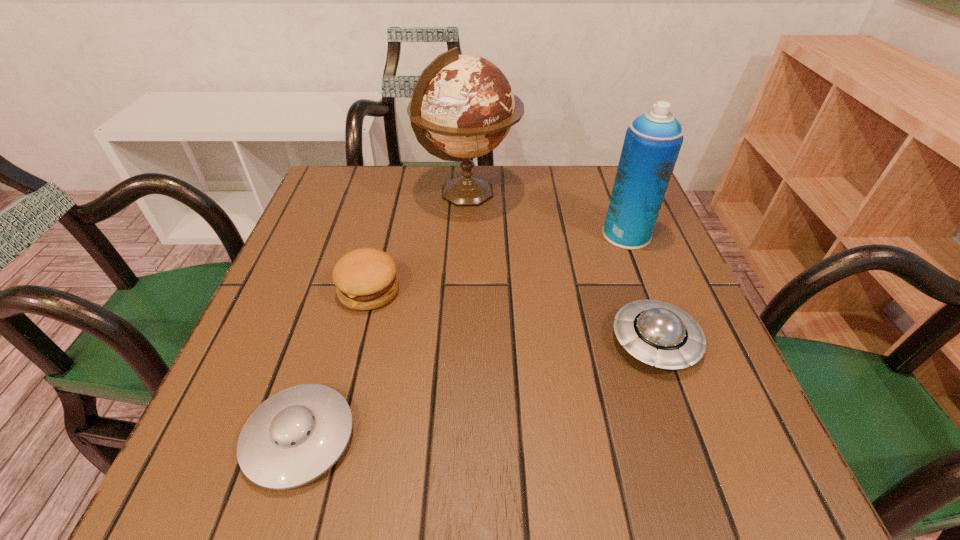
Identify the location of free location located on the left of the right saucer. Image resolution: width=960 pixels, height=540 pixels. (441, 341).

Image resolution: width=960 pixels, height=540 pixels. Identify the location of vacant area situated on the back of the shortest object. (360, 240).

At what (x,y) coordinates should I click in order to perform the action: click on object that is at the far edge. Please return your answer as a coordinate pair (x, y). Looking at the image, I should click on (464, 104).

What are the coordinates of `object situated at the near edge` in the screenshot? It's located at (296, 435).

The height and width of the screenshot is (540, 960). I want to click on hamburger that is at the left edge, so click(x=365, y=279).

This screenshot has height=540, width=960. I want to click on saucer positioned at the left edge, so click(296, 435).

Where is `aerosol can positioned at the right edge`? aerosol can positioned at the right edge is located at coordinates (652, 143).

Identify the location of saucer situated at the right edge. This screenshot has height=540, width=960. (656, 333).

Identify the location of object at the near left corner. This screenshot has height=540, width=960. (296, 435).

What are the coordinates of `vacant point at the far edge` in the screenshot? It's located at [x=390, y=187].